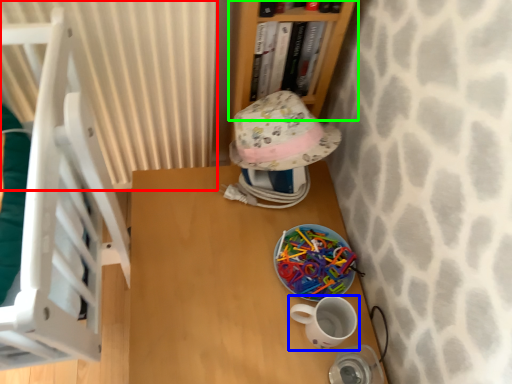
Question: Which object is positioned closest to curtain (highlighted by a red box)? Select from coffee cup (highlighted by a blue box) and bookcase (highlighted by a green box).

Choices:
 (A) coffee cup
 (B) bookcase

Answer: (B)